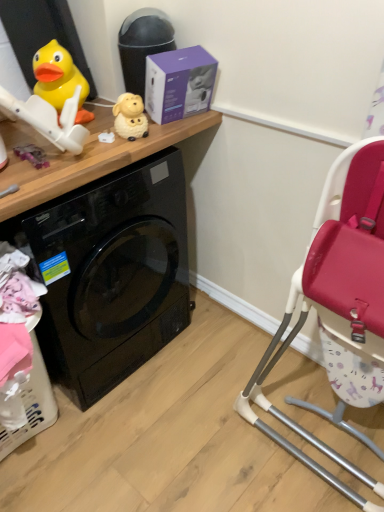
Describe the element at coordinates (179, 83) in the screenshot. The height and width of the screenshot is (512, 384). I see `purple matte box at upper center` at that location.

Identify the location of black glossy washing machine at left. (112, 274).

What do you see at coordinates (130, 117) in the screenshot? I see `white glossy sheep at upper center, the third toy viewed from the left` at bounding box center [130, 117].

Locate an element on the screen. Image resolution: width=384 pixels, height=512 pixels. purple fabric toy at left, the 3th toy from the right is located at coordinates (32, 155).

This screenshot has height=512, width=384. Identify the location of purple matte box at upper center. (179, 83).

Is black glossy washing machine at left taller or shorter than rubber duck at upper left, positioned as the 2th toy in right-to-left order?

black glossy washing machine at left is taller than rubber duck at upper left, positioned as the 2th toy in right-to-left order.

From a real-world perspective, is black glossy washing machine at left below rubber duck at upper left, which ranks as the 2th toy in left-to-right order?

Yes, from a real-world perspective, black glossy washing machine at left is beneath rubber duck at upper left, which ranks as the 2th toy in left-to-right order.

The image size is (384, 512). Find the location of `washing machine below the rubber duck at upper left, positioned as the 2th toy in right-to-left order (from the image's perspective)`. washing machine below the rubber duck at upper left, positioned as the 2th toy in right-to-left order (from the image's perspective) is located at coordinates (112, 274).

Looking at this image, which of these two, black glossy washing machine at left or rubber duck at upper left, which ranks as the 2th toy in left-to-right order, is thinner?

rubber duck at upper left, which ranks as the 2th toy in left-to-right order, is thinner.

How different are the orientations of white glossy sheep at upper center, the first toy positioned from the right, and purple fabric toy at left, the 3th toy from the right, in degrees?

There is a 7.22-degree angle between the facing directions of white glossy sheep at upper center, the first toy positioned from the right, and purple fabric toy at left, the 3th toy from the right.

Is white glossy sheep at upper center, the third toy viewed from the left, facing towards purple fabric toy at left, which is the 1th toy in left-to-right order?

No, white glossy sheep at upper center, the third toy viewed from the left, does not turn towards purple fabric toy at left, which is the 1th toy in left-to-right order.

Is white glossy sheep at upper center, the first toy positioned from the right, in front of or behind purple fabric toy at left, the 3th toy from the right, in the image?

Clearly, white glossy sheep at upper center, the first toy positioned from the right, is behind purple fabric toy at left, the 3th toy from the right.

Does white glossy sheep at upper center, the first toy positioned from the right, have a lesser height compared to purple fabric toy at left, the 3th toy from the right?

Incorrect, the height of white glossy sheep at upper center, the first toy positioned from the right, does not fall short of that of purple fabric toy at left, the 3th toy from the right.

From their relative heights in the image, would you say rubber duck at upper left, positioned as the 2th toy in right-to-left order, is taller or shorter than purple matte box at upper center?

Clearly, rubber duck at upper left, positioned as the 2th toy in right-to-left order, is shorter compared to purple matte box at upper center.

Would you say purple matte box at upper center is part of rubber duck at upper left, which ranks as the 2th toy in left-to-right order,'s contents?

No, purple matte box at upper center is not inside rubber duck at upper left, which ranks as the 2th toy in left-to-right order.

Which point is more forward, (x=54, y=69) or (x=175, y=69)?

The point (x=175, y=69) is closer to the camera.

From the image's perspective, is rubber duck at upper left, which ranks as the 2th toy in left-to-right order, beneath purple matte box at upper center?

Yes.

From the image's perspective, is black glossy washing machine at left located beneath purple fabric toy at left, which is the 1th toy in left-to-right order?

Yes, from the image's perspective, black glossy washing machine at left is beneath purple fabric toy at left, which is the 1th toy in left-to-right order.

Which is more to the left, black glossy washing machine at left or purple fabric toy at left, which is the 1th toy in left-to-right order?

Positioned to the left is purple fabric toy at left, which is the 1th toy in left-to-right order.

Would you consider black glossy washing machine at left to be distant from purple fabric toy at left, which is the 1th toy in left-to-right order?

That's not correct — black glossy washing machine at left is a little close to purple fabric toy at left, which is the 1th toy in left-to-right order.

Is black glossy washing machine at left facing away from purple fabric toy at left, which is the 1th toy in left-to-right order?

No, black glossy washing machine at left is not facing away from purple fabric toy at left, which is the 1th toy in left-to-right order.

Considering the points (126, 102) and (113, 367), which point is in front, point (126, 102) or point (113, 367)?

The point (126, 102) is closer to the camera.

From the image's perspective, is white glossy sheep at upper center, the first toy positioned from the right, on black glossy washing machine at left?

A: Indeed, from the image's perspective, white glossy sheep at upper center, the first toy positioned from the right, is shown above black glossy washing machine at left.

Which is behind, white glossy sheep at upper center, the third toy viewed from the left, or black glossy washing machine at left?

white glossy sheep at upper center, the third toy viewed from the left, is further from the camera.

Does white glossy sheep at upper center, the third toy viewed from the left, turn towards black glossy washing machine at left?

No, white glossy sheep at upper center, the third toy viewed from the left, does not turn towards black glossy washing machine at left.

Is rubber duck at upper left, positioned as the 2th toy in right-to-left order, further to the viewer compared to white glossy sheep at upper center, the first toy positioned from the right?

Yes, rubber duck at upper left, positioned as the 2th toy in right-to-left order, is further from the viewer.

Is rubber duck at upper left, positioned as the 2th toy in right-to-left order, bigger or smaller than white glossy sheep at upper center, the first toy positioned from the right?

In the image, rubber duck at upper left, positioned as the 2th toy in right-to-left order, appears to be larger than white glossy sheep at upper center, the first toy positioned from the right.

Considering the relative positions of rubber duck at upper left, which ranks as the 2th toy in left-to-right order, and white glossy sheep at upper center, the first toy positioned from the right, in the image provided, is rubber duck at upper left, which ranks as the 2th toy in left-to-right order, to the left or to the right of white glossy sheep at upper center, the first toy positioned from the right,?

Based on their positions, rubber duck at upper left, which ranks as the 2th toy in left-to-right order, is located to the left of white glossy sheep at upper center, the first toy positioned from the right.

Is rubber duck at upper left, which ranks as the 2th toy in left-to-right order, next to white glossy sheep at upper center, the third toy viewed from the left, and touching it?

No, rubber duck at upper left, which ranks as the 2th toy in left-to-right order, is not with white glossy sheep at upper center, the third toy viewed from the left.

Locate an element on the screen. The image size is (384, 512). toy on the right of black glossy washing machine at left is located at coordinates (130, 117).

Which object is closer to the camera taking this photo, black glossy washing machine at left or white glossy sheep at upper center, the first toy positioned from the right?

black glossy washing machine at left is closer to the camera.

Considering the relative sizes of black glossy washing machine at left and white glossy sheep at upper center, the third toy viewed from the left, in the image provided, is black glossy washing machine at left thinner than white glossy sheep at upper center, the third toy viewed from the left,?

Incorrect, the width of black glossy washing machine at left is not less than that of white glossy sheep at upper center, the third toy viewed from the left.

Can you tell me how much black glossy washing machine at left and white glossy sheep at upper center, the first toy positioned from the right, differ in facing direction?

The facing directions of black glossy washing machine at left and white glossy sheep at upper center, the first toy positioned from the right, are 14.2 degrees apart.

This screenshot has height=512, width=384. In the image, there is a rubber duck at upper left, positioned as the 2th toy in right-to-left order. Find the location of `washing machine below it (from a real-world perspective)`. washing machine below it (from a real-world perspective) is located at coordinates (112, 274).

In order to click on the 1st toy behind the purple fabric toy at left, which is the 1th toy in left-to-right order, starting your count from the anchor in this screenshot , I will do pos(130,117).

Based on their spatial positions, is purple fabric toy at left, the 3th toy from the right, or white glossy sheep at upper center, the first toy positioned from the right, further from rubber duck at upper left, positioned as the 2th toy in right-to-left order?

The object further to rubber duck at upper left, positioned as the 2th toy in right-to-left order, is purple fabric toy at left, the 3th toy from the right.

Estimate the real-world distances between objects in this image. Which object is closer to rubber duck at upper left, which ranks as the 2th toy in left-to-right order, purple fabric toy at left, the 3th toy from the right, or purple matte box at upper center?

purple fabric toy at left, the 3th toy from the right, is positioned closer to the anchor rubber duck at upper left, which ranks as the 2th toy in left-to-right order.

Estimate the real-world distances between objects in this image. Which object is further from white glossy sheep at upper center, the third toy viewed from the left, purple fabric toy at left, the 3th toy from the right, or purple matte box at upper center?

Among the two, purple fabric toy at left, the 3th toy from the right, is located further to white glossy sheep at upper center, the third toy viewed from the left.

From the picture: Based on their spatial positions, is rubber duck at upper left, positioned as the 2th toy in right-to-left order, or purple fabric toy at left, which is the 1th toy in left-to-right order, further from purple matte box at upper center?

Based on the image, purple fabric toy at left, which is the 1th toy in left-to-right order, appears to be further to purple matte box at upper center.

Based on their spatial positions, is purple fabric toy at left, which is the 1th toy in left-to-right order, or black glossy washing machine at left closer to purple matte box at upper center?

The object closer to purple matte box at upper center is purple fabric toy at left, which is the 1th toy in left-to-right order.

From the image, which object appears to be nearer to purple fabric toy at left, which is the 1th toy in left-to-right order, rubber duck at upper left, which ranks as the 2th toy in left-to-right order, or white glossy sheep at upper center, the first toy positioned from the right?

rubber duck at upper left, which ranks as the 2th toy in left-to-right order, lies closer to purple fabric toy at left, which is the 1th toy in left-to-right order, than the other object.

When comparing their distances from black glossy washing machine at left, does rubber duck at upper left, positioned as the 2th toy in right-to-left order, or purple matte box at upper center seem closer?

Among the two, purple matte box at upper center is located nearer to black glossy washing machine at left.

Looking at the image, which one is located closer to white glossy sheep at upper center, the third toy viewed from the left, purple fabric toy at left, which is the 1th toy in left-to-right order, or black glossy washing machine at left?

purple fabric toy at left, which is the 1th toy in left-to-right order, is closer to white glossy sheep at upper center, the third toy viewed from the left.

At what (x,y) coordinates should I click in order to perform the action: click on toy located between rubber duck at upper left, which ranks as the 2th toy in left-to-right order, and purple matte box at upper center in the left-right direction. Please return your answer as a coordinate pair (x, y). The width and height of the screenshot is (384, 512). Looking at the image, I should click on (130, 117).

Where is `toy between purple fabric toy at left, the 3th toy from the right, and white glossy sheep at upper center, the third toy viewed from the left, in the horizontal direction`? toy between purple fabric toy at left, the 3th toy from the right, and white glossy sheep at upper center, the third toy viewed from the left, in the horizontal direction is located at coordinates (59, 79).

This screenshot has height=512, width=384. Find the location of `toy between white glossy sheep at upper center, the first toy positioned from the right, and black glossy washing machine at left vertically`. toy between white glossy sheep at upper center, the first toy positioned from the right, and black glossy washing machine at left vertically is located at coordinates (32, 155).